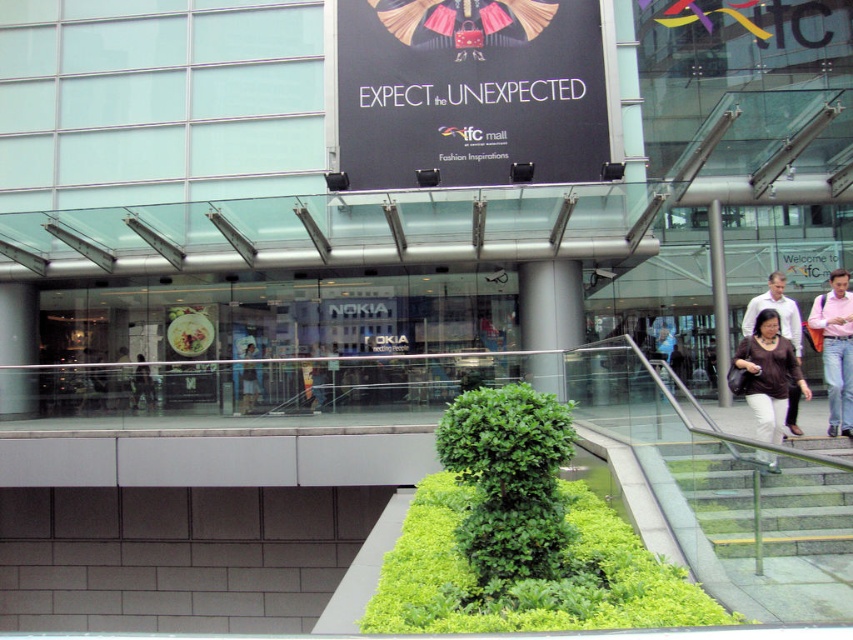
Who is shorter, green granite stairs at lower right or brown matte shirt at lower right?

green granite stairs at lower right is shorter.

From the picture: Which is more to the right, green granite stairs at lower right or brown matte shirt at lower right?

Positioned to the right is brown matte shirt at lower right.

Is point (833, 493) positioned after point (762, 374)?

No.

Locate an element on the screen. The height and width of the screenshot is (640, 853). green granite stairs at lower right is located at coordinates point(762,500).

Who is higher up, green granite stairs at lower right or matte black dress at center?

green granite stairs at lower right

Locate an element on the screen. Image resolution: width=853 pixels, height=640 pixels. green granite stairs at lower right is located at coordinates (762, 500).

The height and width of the screenshot is (640, 853). I want to click on green granite stairs at lower right, so click(x=762, y=500).

Is brown matte shirt at lower right behind pink cotton shirt at right?

No, it is not.

Who is lower down, brown matte shirt at lower right or pink cotton shirt at right?

Positioned lower is brown matte shirt at lower right.

Between point (763, 324) and point (846, 429), which one is positioned behind?

The point (846, 429) is more distant.

Where is `brown matte shirt at lower right`? The width and height of the screenshot is (853, 640). brown matte shirt at lower right is located at coordinates (769, 374).